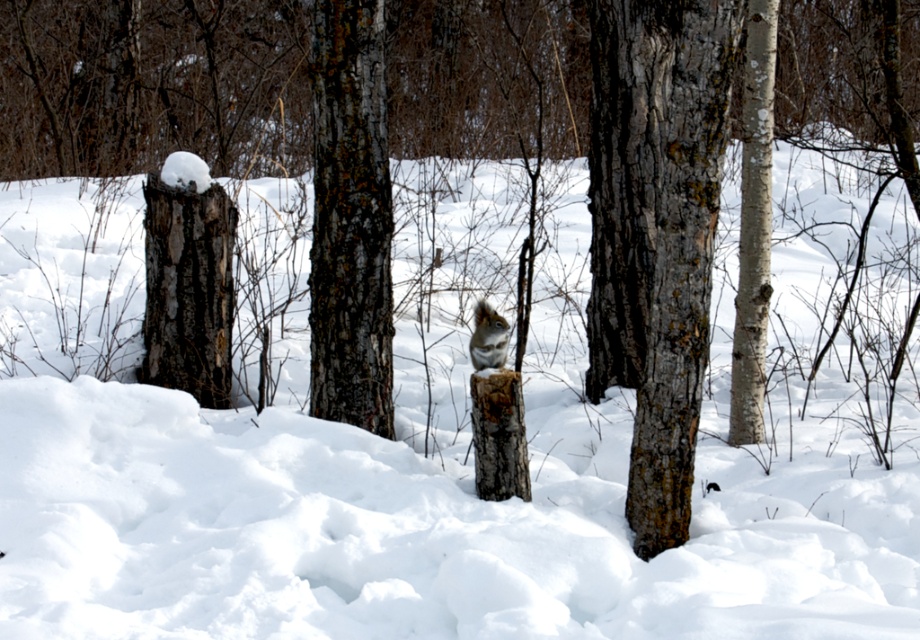
You are standing in the winter forest scene described. You see two points marked in the image. Which point is closer to you, point (750, 328) or point (491, 316)?

Point (750, 328) is closer to you because it is further to the viewer than point (491, 316).